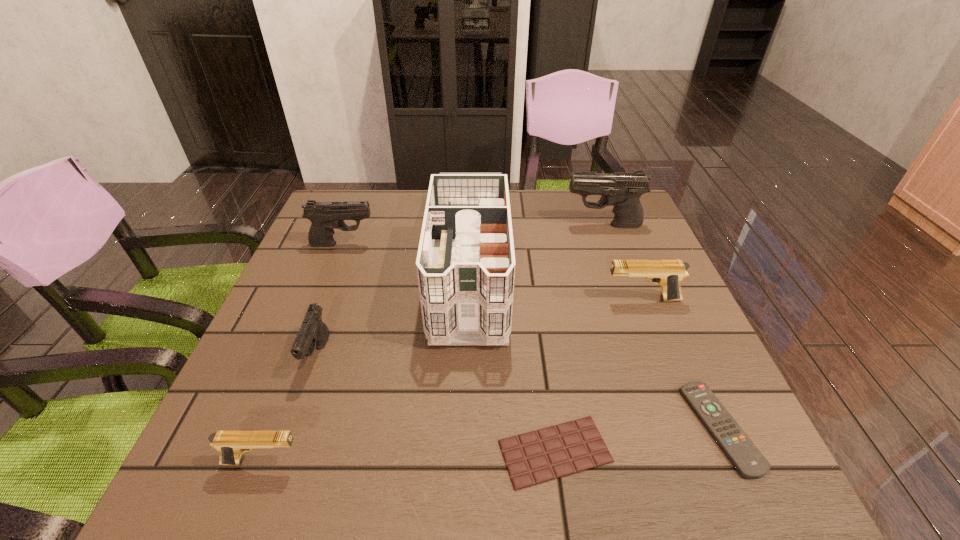
Find the location of a particular element. This screenshot has height=540, width=960. vacant area at the near left corner is located at coordinates (253, 461).

You are a GUI agent. You are given a task and a screenshot of the screen. Output one action in this format:
    pyautogui.click(x=<x>, y=<y>)
    Task: Click on the vacant area that lies between the tallest object and the second smallest black pistol
    Image resolution: width=960 pixels, height=540 pixels.
    Given the screenshot: What is the action you would take?
    pyautogui.click(x=406, y=253)

Identify the location of free spot between the nearer tan pistol and the remote control. (492, 445).

What are the coordinates of `unoccupied position between the third shortest object and the fourth farthest pistol` in the screenshot? It's located at (291, 408).

In order to click on empty space between the tallest object and the tallest pistol in this screenshot , I will do `click(536, 244)`.

You are a GUI agent. You are given a task and a screenshot of the screen. Output one action in this format:
    pyautogui.click(x=<x>, y=<y>)
    Task: Click on the free spot between the second nearest pistol and the chocolate bar
    The image size is (960, 540).
    Given the screenshot: What is the action you would take?
    pyautogui.click(x=437, y=403)

In order to click on vacant area that lies between the sixth tallest object and the fourth farthest pistol in this screenshot , I will do `click(291, 408)`.

Where is `vacant space that's between the tallest object and the brown chocolate bar`? vacant space that's between the tallest object and the brown chocolate bar is located at coordinates (x=512, y=357).

The width and height of the screenshot is (960, 540). I want to click on object that is the fourth closest to the farthest pistol, so click(325, 216).

The image size is (960, 540). Identify the location of object that ranks as the seventh closest to the nearest pistol. (622, 190).